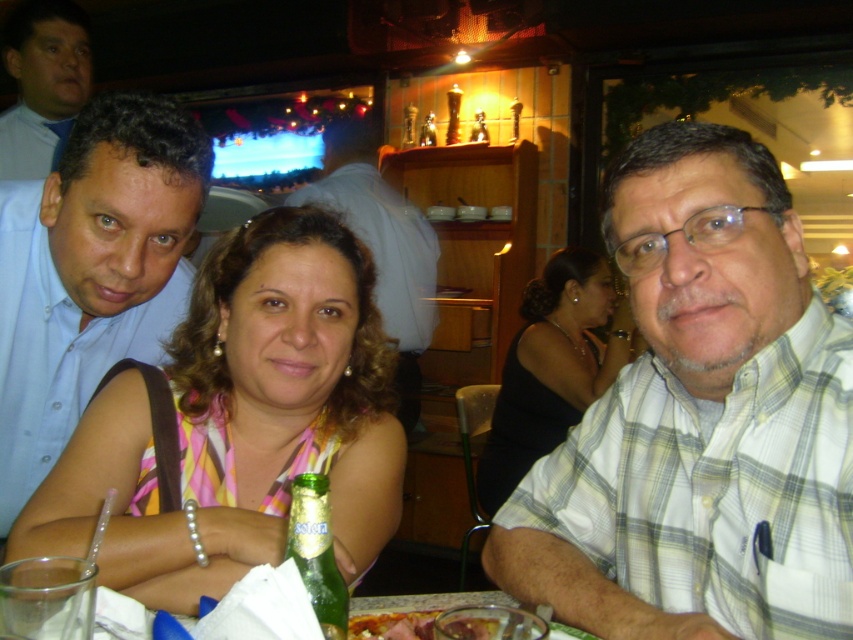
Question: Among these objects, which one is farthest from the camera?

Choices:
 (A) matte blue shirt at center
 (B) pink fabric dress at center
 (C) shiny glass bowl at lower center
 (D) white plaid shirt at center

Answer: (A)

Question: Based on their relative distances, which object is nearer to the white plaid shirt at center?

Choices:
 (A) green glass bottle at center
 (B) pink striped dress at center

Answer: (B)

Question: Is white plaid shirt at center further to the viewer compared to pink fabric dress at center?

Choices:
 (A) no
 (B) yes

Answer: (A)

Question: From the image, what is the correct spatial relationship of white plaid shirt at center in relation to pink fabric dress at center?

Choices:
 (A) left
 (B) right

Answer: (A)

Question: Which point is closer to the camera taking this photo?

Choices:
 (A) (354, 136)
 (B) (99, 122)

Answer: (B)

Question: Does pink fabric dress at center appear over shiny glass bowl at lower center?

Choices:
 (A) yes
 (B) no

Answer: (A)